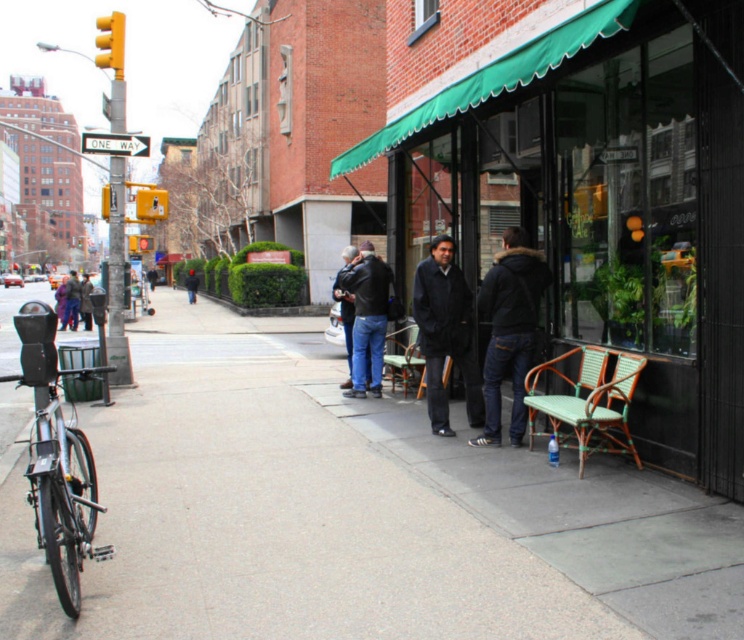
Question: Can you confirm if smooth concrete sidewalk at center is positioned above silver metallic bicycle at lower left?

Choices:
 (A) yes
 (B) no

Answer: (B)

Question: Among these points, which one is farthest from the camera?

Choices:
 (A) (62, 378)
 (B) (190, 298)

Answer: (B)

Question: Which point appears farthest from the camera in this image?

Choices:
 (A) pos(443,298)
 (B) pos(347,392)
 (C) pos(190,300)

Answer: (C)

Question: Can you confirm if dark blue jeans at center is smaller than dark brown leather jacket at center?

Choices:
 (A) no
 (B) yes

Answer: (B)

Question: Can you confirm if green fabric awning at upper right is bigger than dark blue fabric jacket at center?

Choices:
 (A) no
 (B) yes

Answer: (A)

Question: Considering the real-world distances, which object is closest to the dark blue jacket at center?

Choices:
 (A) dark blue fabric jacket at center
 (B) dark blue jeans at center
 (C) matte black jacket at center
 (D) dark brown leather jacket at center

Answer: (D)